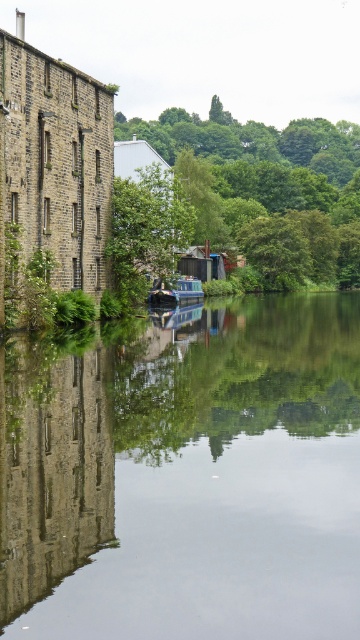
You are standing at the riverside and see the point marked at coordinates (263, 160). What object is located at that point?

The point at coordinates (263, 160) marks the location of the green leafy tree at upper center.

You are standing at the riverside and want to take a photo of the green leafy tree at upper center. Which direction should you face to ensure the tree is in the center of your photo?

You should face towards the upper center direction to have the green leafy tree at upper center in the center of your photo.

You are standing on the riverside and want to take a photo of both the green leafy tree at upper center and the blue glossy canal boat at center. Which object will appear larger in the photo?

The green leafy tree at upper center will appear larger in the photo because it is much taller than the blue glossy canal boat at center.